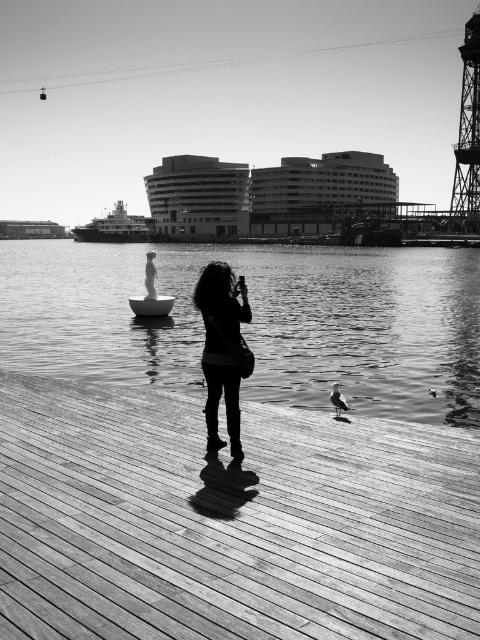
You are a photographer trying to capture the silky black hair at center and the metallic ship at center in the same frame. Based on their sizes, which object should you zoom in on to ensure both fit in the photo?

The silky black hair at center is narrower than the metallic ship at center, so you should zoom out to capture both in the frame.

You are a photographer positioned on the wooden boardwalk. You want to take a photo that includes both the wooden at center and the metallic ship at center. Which object should you focus on first to ensure both are in clear view?

You should focus on the wooden at center first because it is closer to you than the metallic ship at center. By focusing on the closer object, the metallic ship at center will also be in focus due to the depth of field.

You are a photographer standing on the wooden boardwalk. You want to take a photo that includes both the silky black hair at center and the metallic ship at center. Which object should you focus on first to ensure both are in sharp focus?

You should focus on the silky black hair at center first because it is closer to the viewer than the metallic ship at center. By focusing on the closer object, the metallic ship at center will fall into the depth of field and remain sharp.